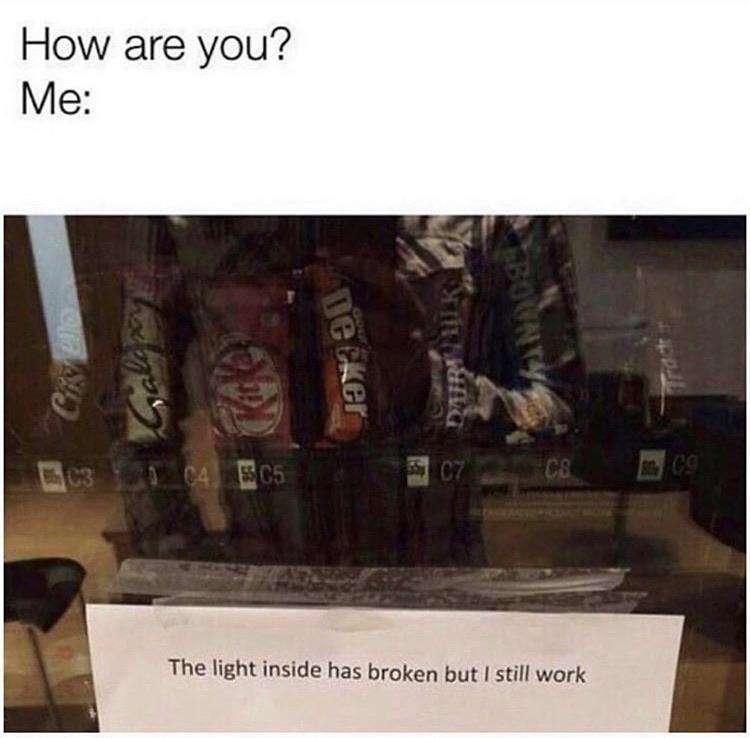
The width and height of the screenshot is (750, 738). What are the coordinates of `reflection of window` in the screenshot? It's located at (705, 255).